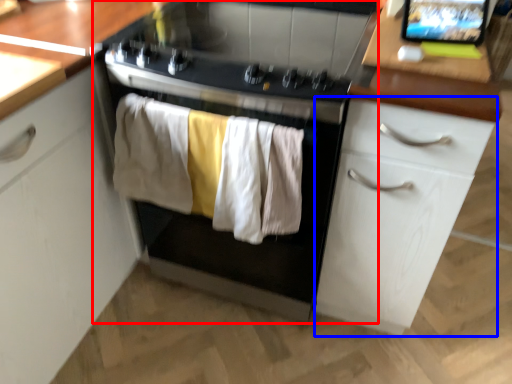
Question: Which of the following is the closest to the observer, home appliance (highlighted by a red box) or cabinetry (highlighted by a blue box)?

Choices:
 (A) home appliance
 (B) cabinetry

Answer: (B)